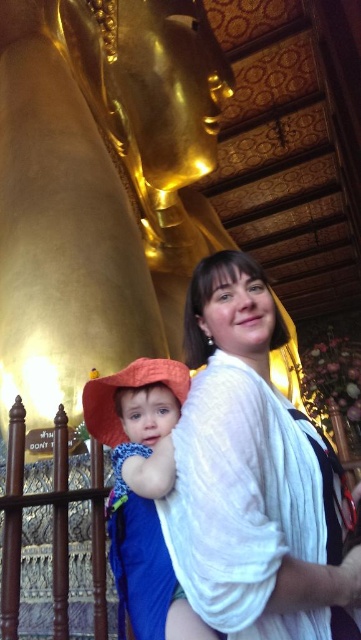
You are a photographer taking a picture of the temple scene. You notice the orange fabric hat at left and the blue cotton robe at lower left. Which object would appear bigger in your photo?

The orange fabric hat at left appears bigger in the photo because it is larger in size than the blue cotton robe at lower left.